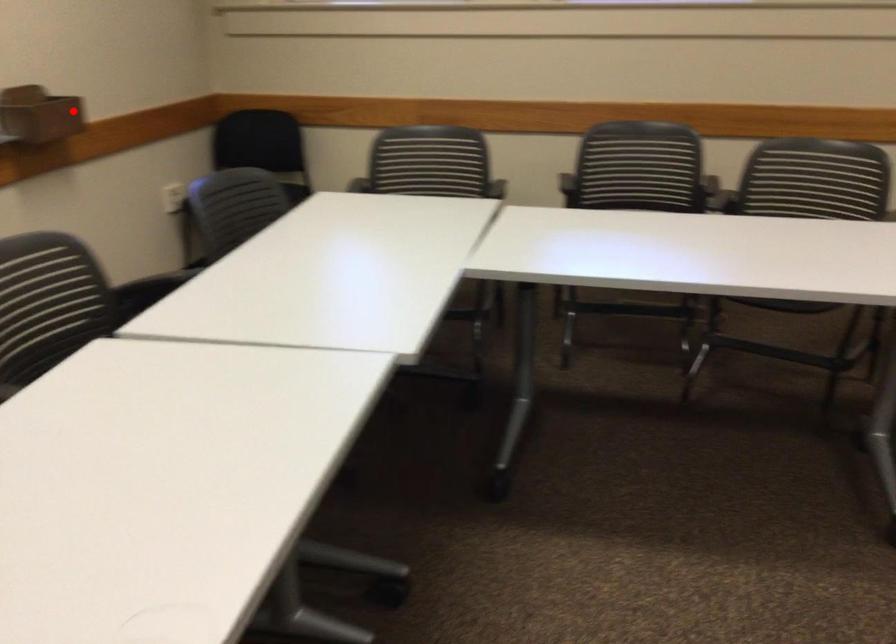
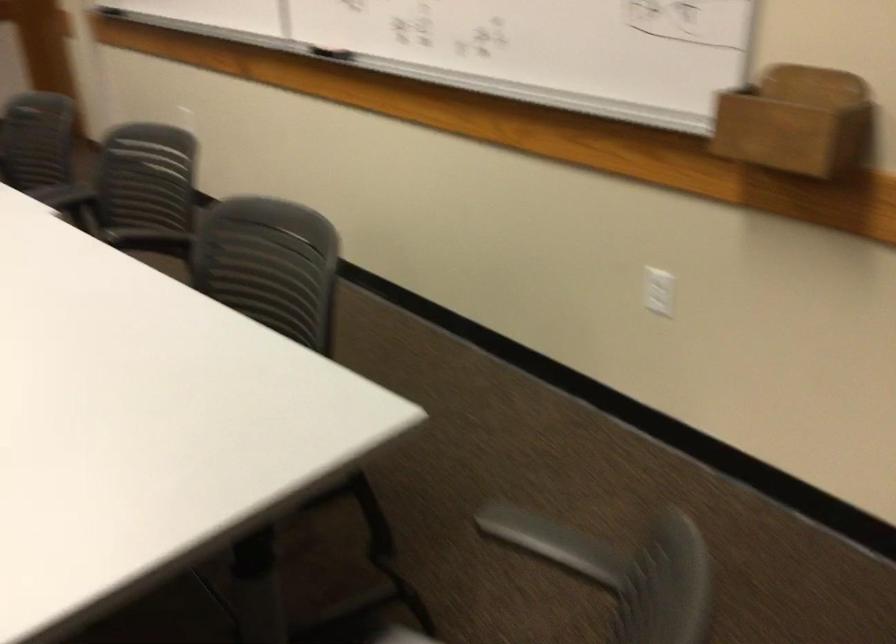
The point at the highlighted location is marked in the first image. Where is the corresponding point in the second image?

(797, 122)